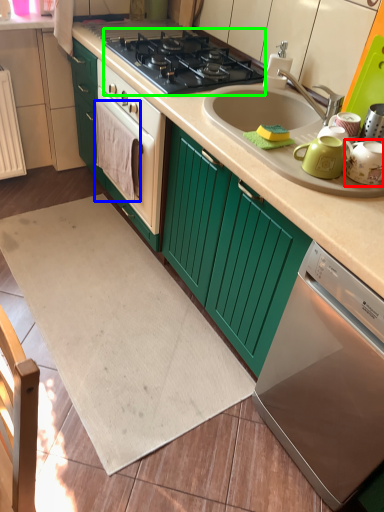
Question: Estimate the real-world distances between objects in this image. Which object is closer to tea pot (highlighted by a red box), blanket (highlighted by a blue box) or gas stove (highlighted by a green box)?

Choices:
 (A) blanket
 (B) gas stove

Answer: (B)